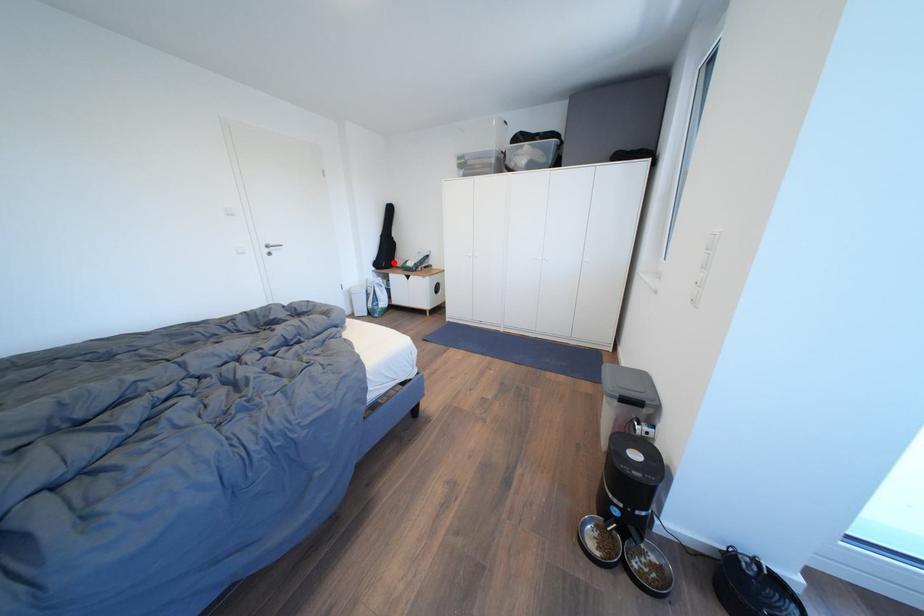
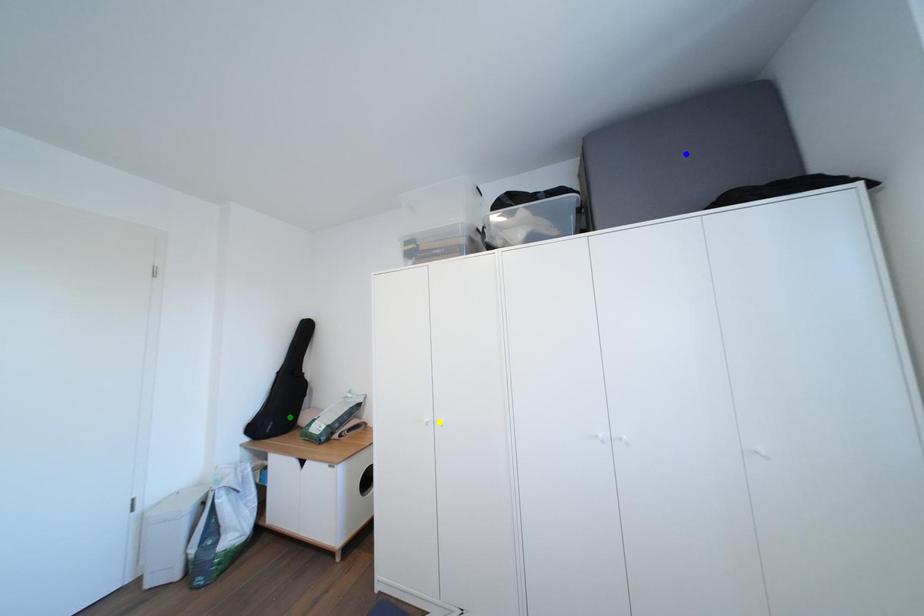
Question: I am providing you with two images of the same scene from different viewpoints. A red point is marked on the first image. You are given multiple points on the second image. Which point in image 2 represents the same 3d spot as the red point in image 1?

Choices:
 (A) green point
 (B) yellow point
 (C) blue point

Answer: (A)